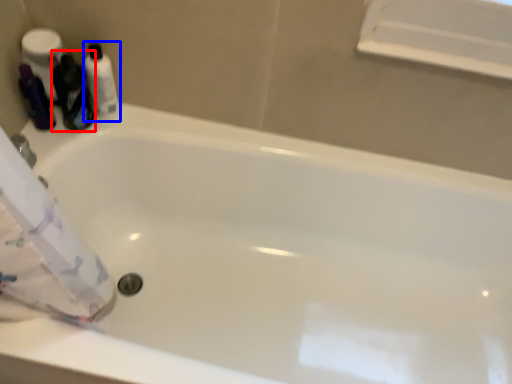
Question: Which of the following is the farthest to the observer, cleaning product (highlighted by a red box) or toiletry (highlighted by a blue box)?

Choices:
 (A) cleaning product
 (B) toiletry

Answer: (B)